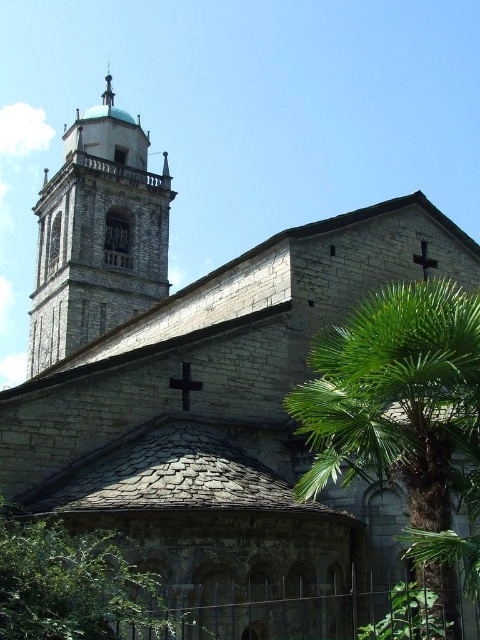
In the scene shown: You are standing at the entrance of the historic stone church and want to take a photo of the green leafy tree at lower center. According to the image, where should you position yourself to capture the tree in the frame?

To capture the green leafy tree at lower center in the frame, position yourself at the entrance and aim your camera towards the lower center area, as the tree is located at point coordinates of 0.917 on the x axis and 0.158 on the y axis.

You are a drone operator tasked with flying a drone from the green leafy tree at lower center to the polished silver spire at upper center. Given that the drone has a maximum flight range of 100 meters, will it be able to reach the spire without needing to recharge?

The distance between the green leafy tree at lower center and the polished silver spire at upper center is 114.56 meters. Since the drone can only fly 100 meters before needing to recharge, it will not be able to reach the spire without recharging.